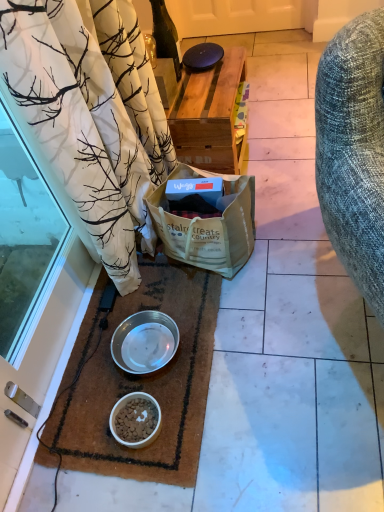
The height and width of the screenshot is (512, 384). Find the location of `empty space that is to the right of white matte bowl at lower center, placed as the first bowl when sorted from bottom to top`. empty space that is to the right of white matte bowl at lower center, placed as the first bowl when sorted from bottom to top is located at coordinates (185, 407).